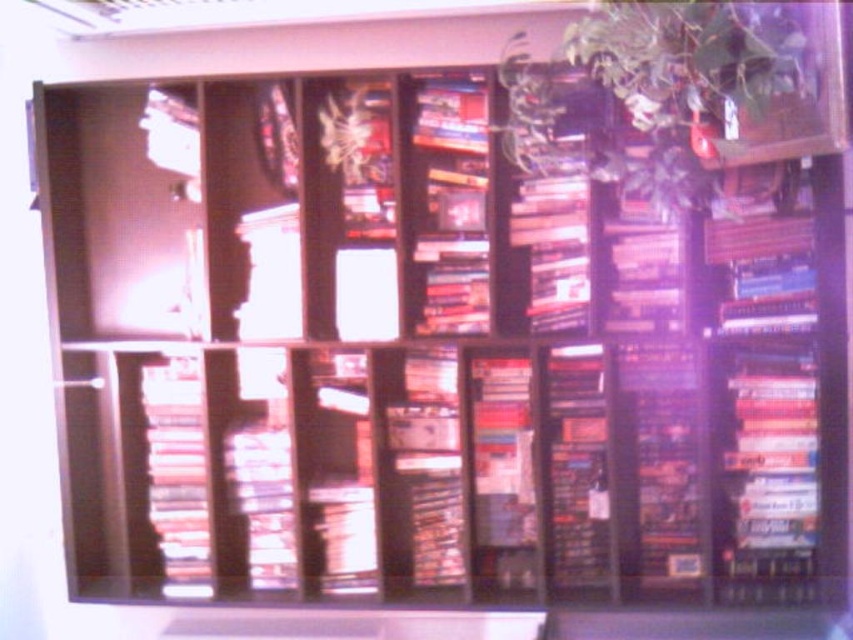
Is hardcover book at right below matte plastic books at left?

Incorrect, hardcover book at right is not positioned below matte plastic books at left.

This screenshot has height=640, width=853. I want to click on hardcover book at right, so click(x=764, y=468).

Can you confirm if green leafy plant at upper right is taller than matte white statue at center?

Indeed, green leafy plant at upper right has a greater height compared to matte white statue at center.

Can you confirm if green leafy plant at upper right is positioned above matte white statue at center?

Correct, green leafy plant at upper right is located above matte white statue at center.

What do you see at coordinates (651, 90) in the screenshot? This screenshot has height=640, width=853. I see `green leafy plant at upper right` at bounding box center [651, 90].

Locate an element on the screen. green leafy plant at upper right is located at coordinates (651, 90).

Which is behind, point (792, 397) or point (241, 330)?

Positioned behind is point (241, 330).

Can you confirm if hardcover book at right is bigger than matte white statue at center?

Yes.

Between point (759, 358) and point (271, 308), which one is positioned behind?

The point (271, 308) is behind.

The width and height of the screenshot is (853, 640). What are the coordinates of `hardcover book at right` in the screenshot? It's located at (764, 468).